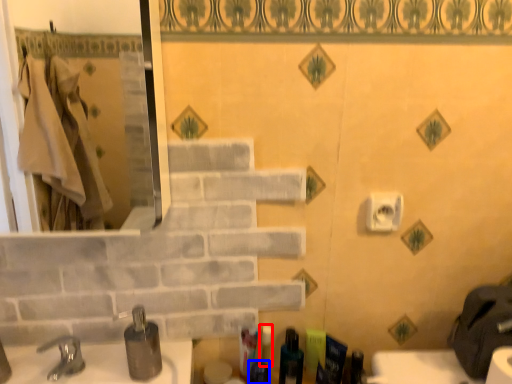
Question: Which point is further to the camera, toiletry (highlighted by a red box) or toiletry (highlighted by a blue box)?

Choices:
 (A) toiletry
 (B) toiletry

Answer: (A)